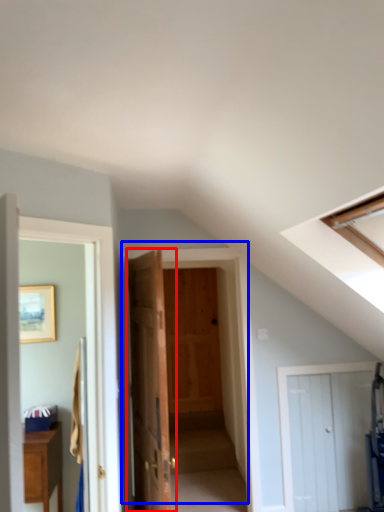
Question: Which of the following is the farthest to the observer, door (highlighted by a red box) or door (highlighted by a blue box)?

Choices:
 (A) door
 (B) door

Answer: (B)